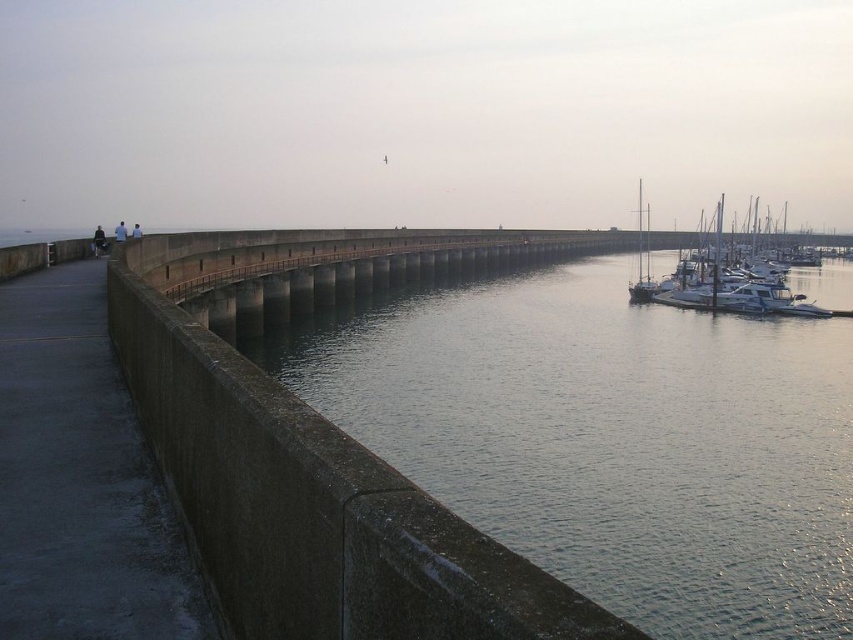
You are standing on the curved concrete wall and see two sailboats in the water. Which one is positioned further to the right between the white glossy sailboat at right and the silver metallic sailboat at right?

The white glossy sailboat at right is positioned further to the right compared to the silver metallic sailboat at right.

You are standing at the center of the curved concrete wall with the metal railing. You want to reach the white glossy sailboat at right. Which direction should you walk to get closer to the sailboat?

The white glossy sailboat at right is located at point (x=718, y=291), so you should walk towards the right side of the wall to get closer to the sailboat.